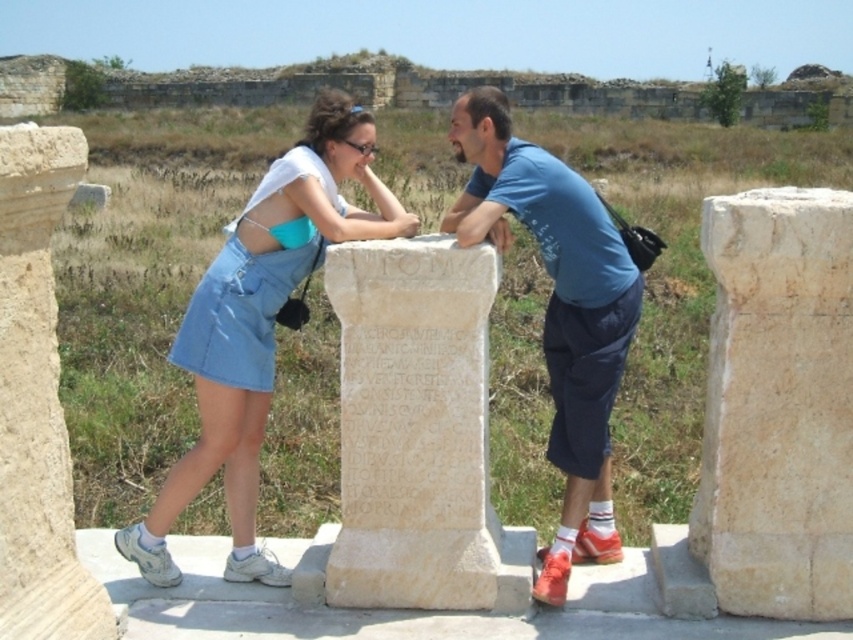
Question: Among these objects, which one is nearest to the camera?

Choices:
 (A) white marble stone at center
 (B) beige stone pillar at right
 (C) denim skirt at center

Answer: (B)

Question: Which object appears farthest from the camera in this image?

Choices:
 (A) beige stone pillar at left
 (B) blue cotton t-shirt at center
 (C) white marble stone at center
 (D) beige stone pillar at right

Answer: (B)

Question: Does beige stone pillar at right have a larger size compared to beige stone pillar at left?

Choices:
 (A) no
 (B) yes

Answer: (B)

Question: Can you confirm if beige stone pillar at right is wider than beige stone pillar at left?

Choices:
 (A) no
 (B) yes

Answer: (B)

Question: Which point is farther from the camera taking this photo?

Choices:
 (A) (434, 372)
 (B) (769, 193)

Answer: (A)

Question: Does beige stone pillar at right have a smaller size compared to white marble stone at center?

Choices:
 (A) no
 (B) yes

Answer: (B)